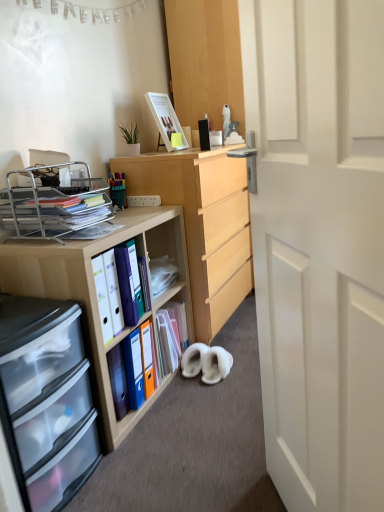
The image size is (384, 512). Find the location of `vacant space in front of white suede slippers at lower center, which ranks as the second footwear in right-to-left order`. vacant space in front of white suede slippers at lower center, which ranks as the second footwear in right-to-left order is located at coordinates (194, 389).